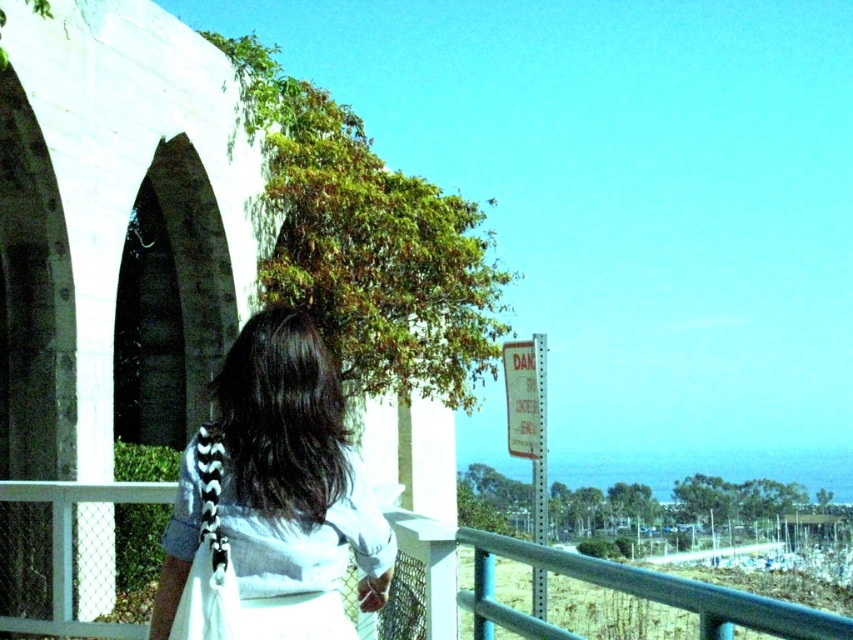
Question: Is dark brown hair at center to the right of smooth teal railing at center from the viewer's perspective?

Choices:
 (A) no
 (B) yes

Answer: (A)

Question: Can you confirm if dark brown hair at center is positioned below smooth teal railing at center?

Choices:
 (A) yes
 (B) no

Answer: (B)

Question: Is dark brown hair at center wider than smooth teal railing at center?

Choices:
 (A) no
 (B) yes

Answer: (A)